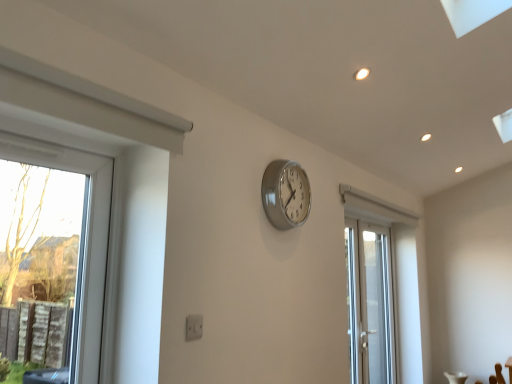
Question: Considering the relative positions of white glossy door at center-right and silver metallic clock at center in the image provided, is white glossy door at center-right in front of silver metallic clock at center?

Choices:
 (A) no
 (B) yes

Answer: (A)

Question: Considering the relative sizes of white glossy door at center-right and silver metallic clock at center in the image provided, is white glossy door at center-right bigger than silver metallic clock at center?

Choices:
 (A) no
 (B) yes

Answer: (B)

Question: Does white glossy door at center-right have a smaller size compared to silver metallic clock at center?

Choices:
 (A) yes
 (B) no

Answer: (B)

Question: Is white glossy door at center-right looking in the opposite direction of silver metallic clock at center?

Choices:
 (A) yes
 (B) no

Answer: (B)

Question: Is silver metallic clock at center a part of white glossy door at center-right?

Choices:
 (A) yes
 (B) no

Answer: (B)

Question: Considering the relative positions of white glossy door at center-right and silver metallic clock at center in the image provided, is white glossy door at center-right behind silver metallic clock at center?

Choices:
 (A) yes
 (B) no

Answer: (A)

Question: Is silver metallic clock at center taller than white glossy door at center-right?

Choices:
 (A) yes
 (B) no

Answer: (B)

Question: Is white glossy door at center-right a part of silver metallic clock at center?

Choices:
 (A) yes
 (B) no

Answer: (B)

Question: From the image's perspective, does silver metallic clock at center appear higher than white glossy door at center-right?

Choices:
 (A) no
 (B) yes

Answer: (B)

Question: From the image's perspective, would you say silver metallic clock at center is shown under white glossy door at center-right?

Choices:
 (A) no
 (B) yes

Answer: (A)

Question: Can you confirm if silver metallic clock at center is bigger than white glossy door at center-right?

Choices:
 (A) no
 (B) yes

Answer: (A)

Question: Could you tell me if silver metallic clock at center is turned towards white glossy door at center-right?

Choices:
 (A) no
 (B) yes

Answer: (A)

Question: From their relative heights in the image, would you say silver metallic clock at center is taller or shorter than white glossy door at center-right?

Choices:
 (A) tall
 (B) short

Answer: (B)